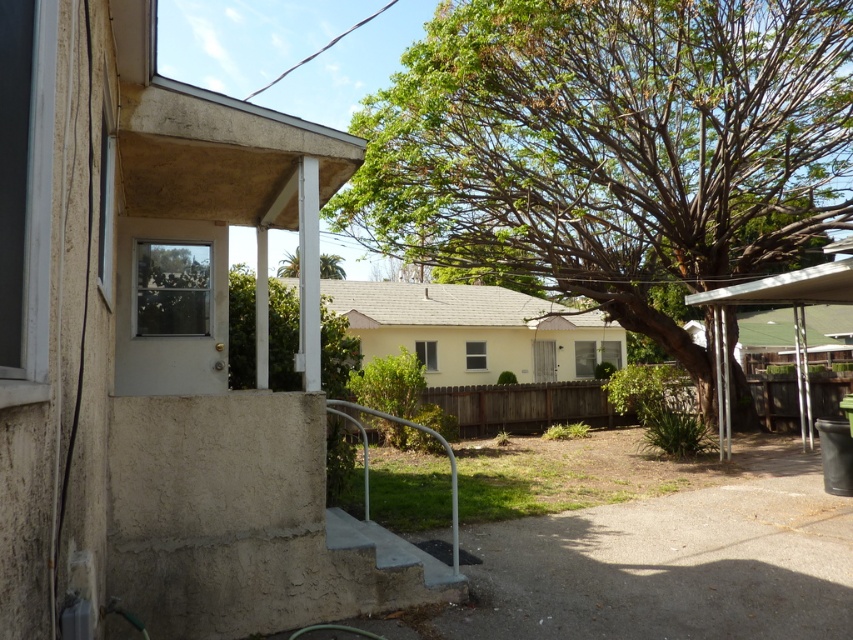
Question: Is green leafy tree at center above green leafy tree at upper center?

Choices:
 (A) no
 (B) yes

Answer: (A)

Question: From the image, what is the correct spatial relationship of green leafy tree at center in relation to green leafy tree at upper center?

Choices:
 (A) right
 (B) left

Answer: (A)

Question: Which point is farther to the camera?

Choices:
 (A) green leafy tree at center
 (B) green leafy tree at upper center

Answer: (B)

Question: Observing the image, what is the correct spatial positioning of green leafy tree at center in reference to green leafy tree at upper center?

Choices:
 (A) left
 (B) right

Answer: (B)